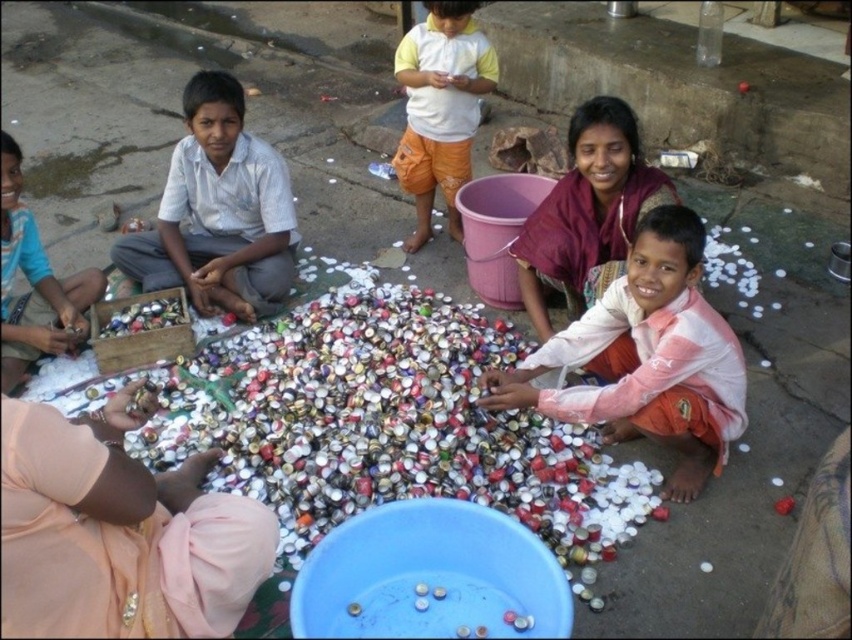
Between matte pink fabric at center and yellow cotton shirt at upper center, which one has more height?

With more height is yellow cotton shirt at upper center.

Does matte pink fabric at center have a lesser height compared to yellow cotton shirt at upper center?

Indeed, matte pink fabric at center has a lesser height compared to yellow cotton shirt at upper center.

Measure the distance between point (599,122) and camera.

The distance of point (599,122) from camera is 8.68 feet.

Identify the location of matte pink fabric at center. (586, 212).

Can you confirm if light gray cotton shirt at center is taller than matte blue shirt at lower left?

Yes.

Between light gray cotton shirt at center and matte blue shirt at lower left, which one is positioned higher?

light gray cotton shirt at center is higher up.

What do you see at coordinates (217, 211) in the screenshot? The height and width of the screenshot is (640, 852). I see `light gray cotton shirt at center` at bounding box center [217, 211].

At what (x,y) coordinates should I click in order to perform the action: click on light gray cotton shirt at center. Please return your answer as a coordinate pair (x, y). Looking at the image, I should click on (217, 211).

Who is more distant from viewer, (695, 356) or (245, 161)?

Positioned behind is point (245, 161).

Does pink fabric shirt at lower right appear on the right side of light gray cotton shirt at center?

Correct, you'll find pink fabric shirt at lower right to the right of light gray cotton shirt at center.

Does point (676, 337) lie behind point (176, 186)?

No, (676, 337) is in front of (176, 186).

Locate an element on the screen. Image resolution: width=852 pixels, height=640 pixels. pink fabric shirt at lower right is located at coordinates (648, 356).